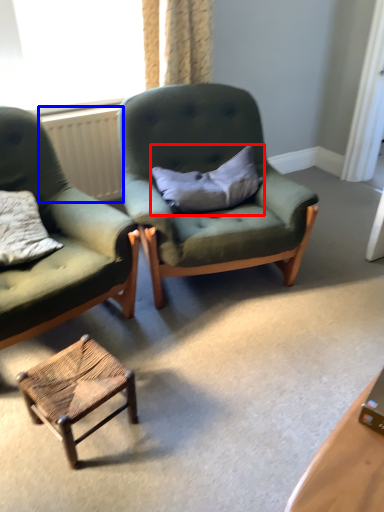
Question: Which object appears closest to the camera in this image, pillow (highlighted by a red box) or radiator (highlighted by a blue box)?

Choices:
 (A) pillow
 (B) radiator

Answer: (A)